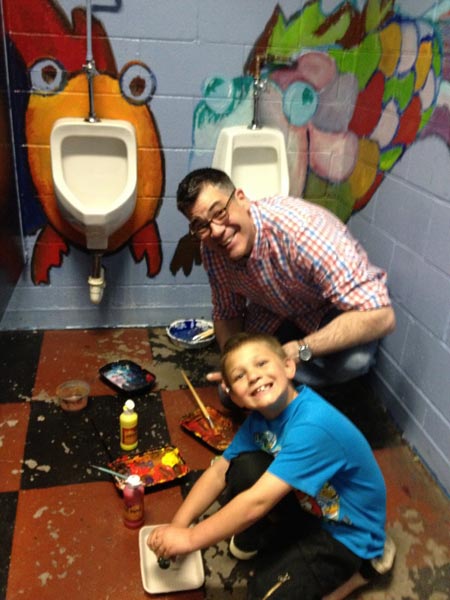
I want to click on urinals, so click(102, 187), click(252, 176).